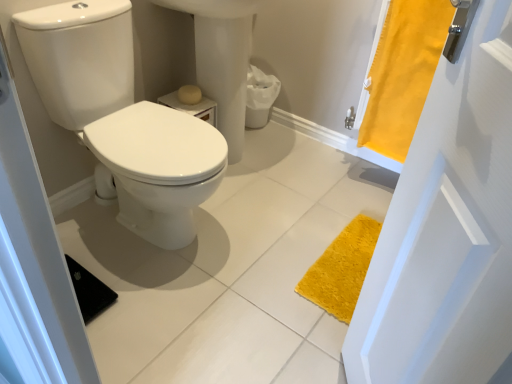
Find the location of a particular element. empty space that is in between white glossy toilet at left and white glossy sink at center is located at coordinates (252, 192).